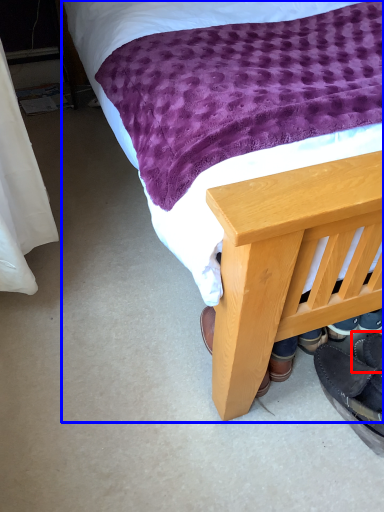
Question: Among these objects, which one is nearest to the camera, footwear (highlighted by a red box) or bed (highlighted by a blue box)?

Choices:
 (A) footwear
 (B) bed

Answer: (B)